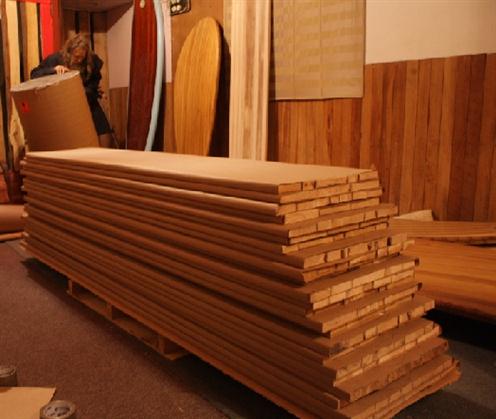
At what (x,y) coordinates should I click in order to perform the action: click on brown carpet. Please return your answer as a coordinate pair (x, y). The height and width of the screenshot is (419, 496). Looking at the image, I should click on (137, 398).